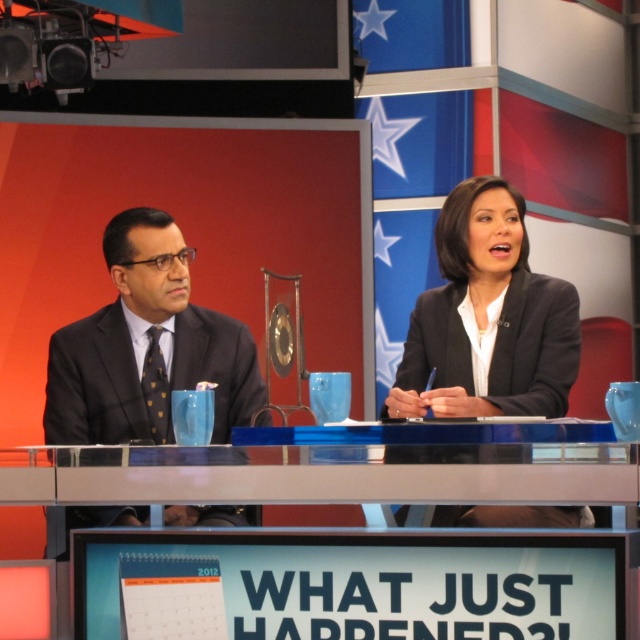
You are a camera operator setting up for a live broadcast. You need to position the camera so that both the blue plastic table at center and the black glossy blazer at center are visible. Based on their positions, which object should be closer to the camera?

The blue plastic table at center is in front of the black glossy blazer at center, so the blue plastic table at center should be closer to the camera.

You are a costume designer preparing for a TV show and need to arrange two outfits on the news desk. The black glossy blazer at center and the matte black suit at left must be placed in the correct spatial order as shown in the scene. Which outfit should be placed closer to the camera to match the original setup?

The black glossy blazer at center should be placed closer to the camera because it is in front of the matte black suit at left in the original scene.

You are standing at the entrance of the studio and want to approach the blue plastic table at center. Which direction should you walk to reach it?

Since the blue plastic table at center is located at point 0.912 on the x axis and 0.550 on the y axis, you should walk towards the center of the studio to reach it.